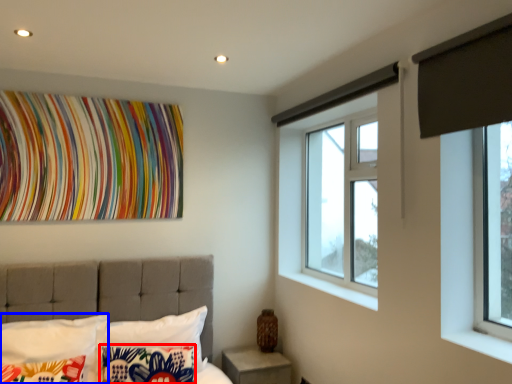
Question: Which object appears closest to the camera in this image, pillow (highlighted by a red box) or pillow (highlighted by a blue box)?

Choices:
 (A) pillow
 (B) pillow

Answer: (B)